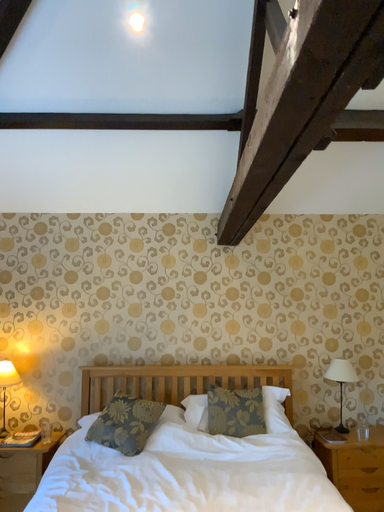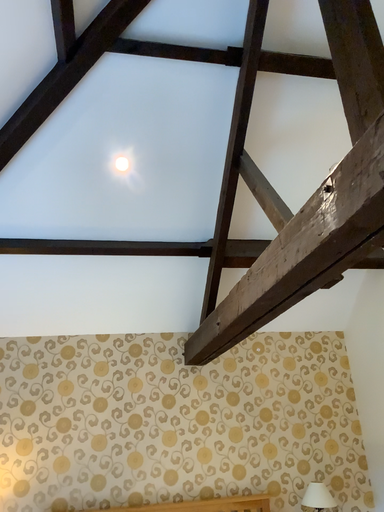
Question: How did the camera likely rotate when shooting the video?

Choices:
 (A) rotated right
 (B) rotated left

Answer: (A)